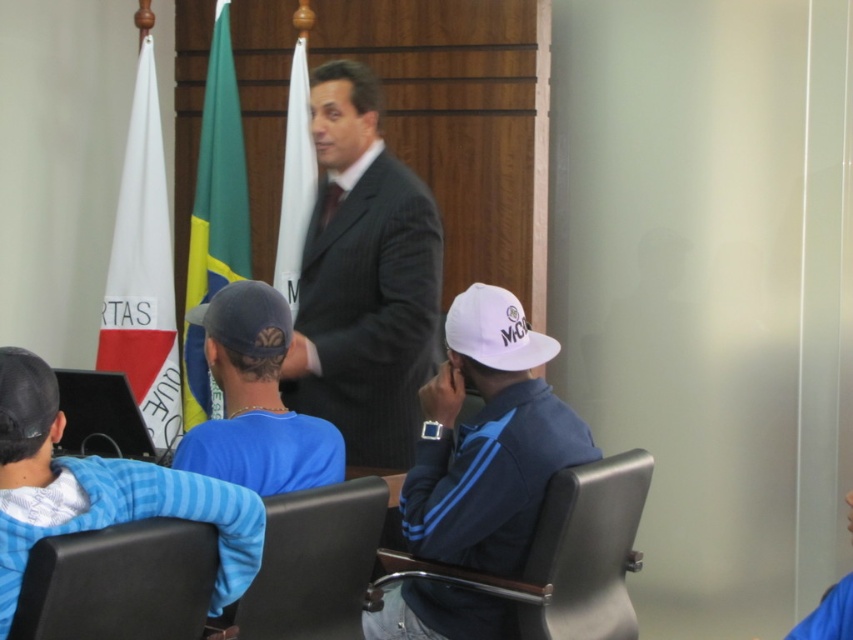
Question: Observing the image, what is the correct spatial positioning of dark gray pinstripe suit at center in reference to blue matte cap at center?

Choices:
 (A) below
 (B) above

Answer: (B)

Question: Is white fabric flag at center below black matte baseball cap at lower left?

Choices:
 (A) no
 (B) yes

Answer: (A)

Question: Which of the following is the closest to the observer?

Choices:
 (A) white matte cap at lower center
 (B) white fabric flag at left

Answer: (A)

Question: Is blue striped shirt at lower left wider than blue matte cap at center?

Choices:
 (A) no
 (B) yes

Answer: (B)

Question: Which of the following is the farthest from the observer?

Choices:
 (A) (239, 456)
 (B) (347, 74)
 (C) (161, 323)
 (D) (202, 140)

Answer: (D)

Question: Among these points, which one is farthest from the camera?

Choices:
 (A) (556, 410)
 (B) (254, 289)

Answer: (A)